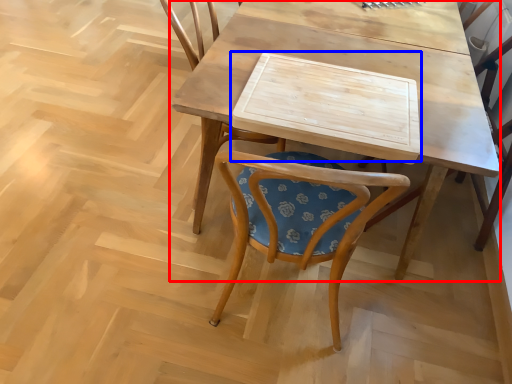
Question: Which object is closer to the camera taking this photo, table (highlighted by a red box) or plank (highlighted by a blue box)?

Choices:
 (A) table
 (B) plank

Answer: (A)